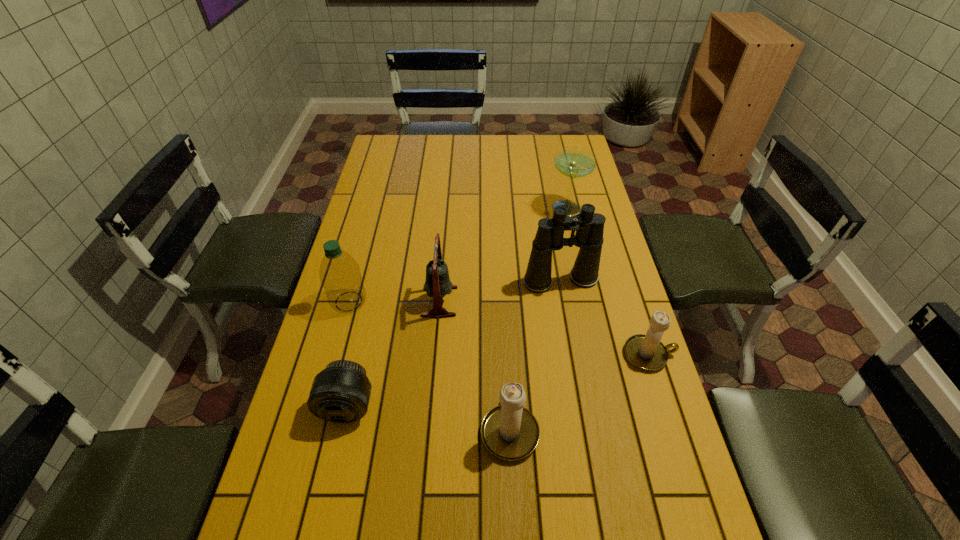
This screenshot has width=960, height=540. Identify the location of free space that is in between the shortest object and the tallest object. (454, 343).

Locate an element on the screen. This screenshot has height=540, width=960. free spot between the left candle holder and the water bottle is located at coordinates (429, 365).

This screenshot has width=960, height=540. Identify the location of unoccupied area between the telephoto lens and the tallest object. (454, 343).

In order to click on vacant point located between the shorter candle holder and the martini in this screenshot , I will do `click(607, 282)`.

Find the location of `free space between the nearer candle holder and the shortest object`. free space between the nearer candle holder and the shortest object is located at coordinates (428, 417).

The height and width of the screenshot is (540, 960). What are the coordinates of `free space between the water bottle and the tallest object` in the screenshot? It's located at (455, 291).

Choose which object is the nearest neighbor to the binoculars. Please provide its 2D coordinates. Your answer should be formatted as a tuple, i.e. [(x, y)], where the tuple contains the x and y coordinates of a point satisfying the conditions above.

[(646, 352)]

Identify which object is the third nearest to the binoculars. Please provide its 2D coordinates. Your answer should be formatted as a tuple, i.e. [(x, y)], where the tuple contains the x and y coordinates of a point satisfying the conditions above.

[(574, 162)]